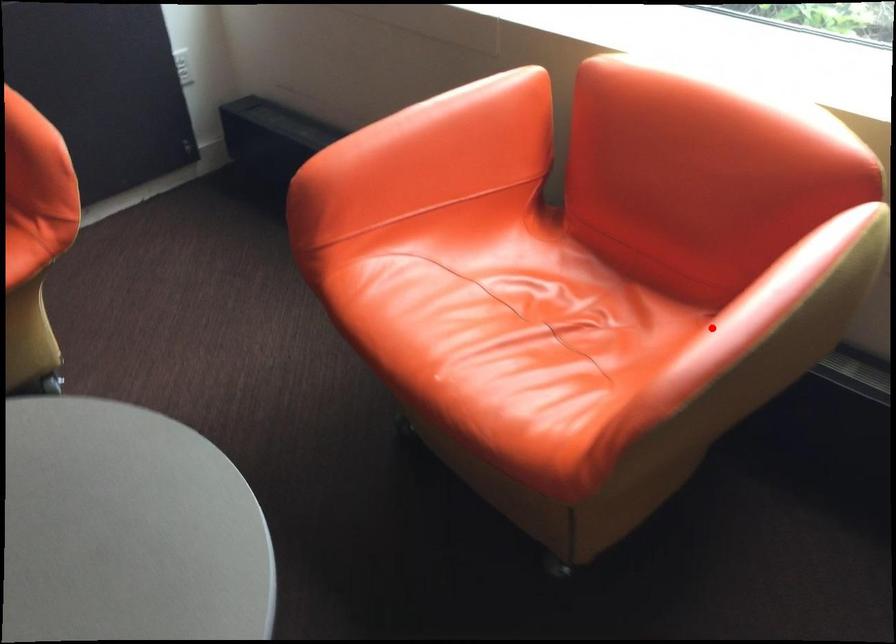
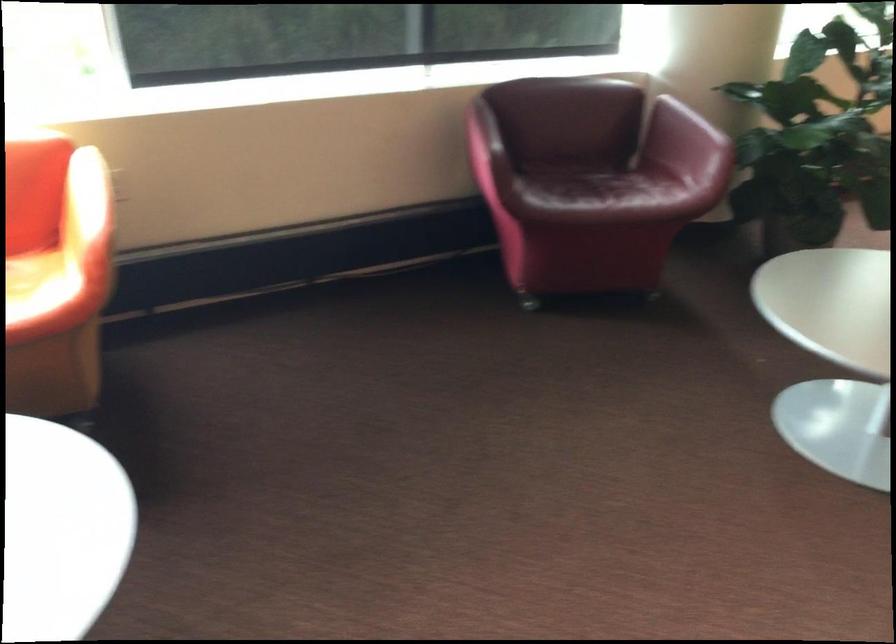
Locate, in the second image, the point that corresponds to the highlighted location in the first image.

(85, 200)